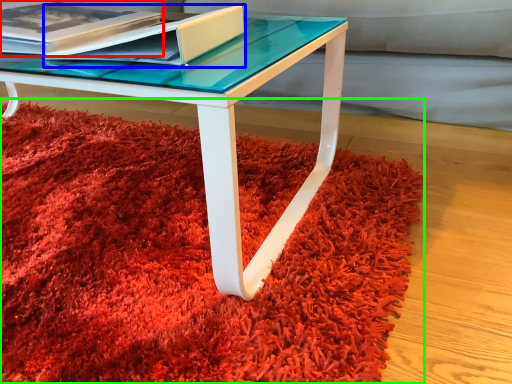
Question: Which object is positioned closest to paperback book (highlighted by a red box)? Select from paperback book (highlighted by a blue box) and mat (highlighted by a green box).

Choices:
 (A) paperback book
 (B) mat

Answer: (A)